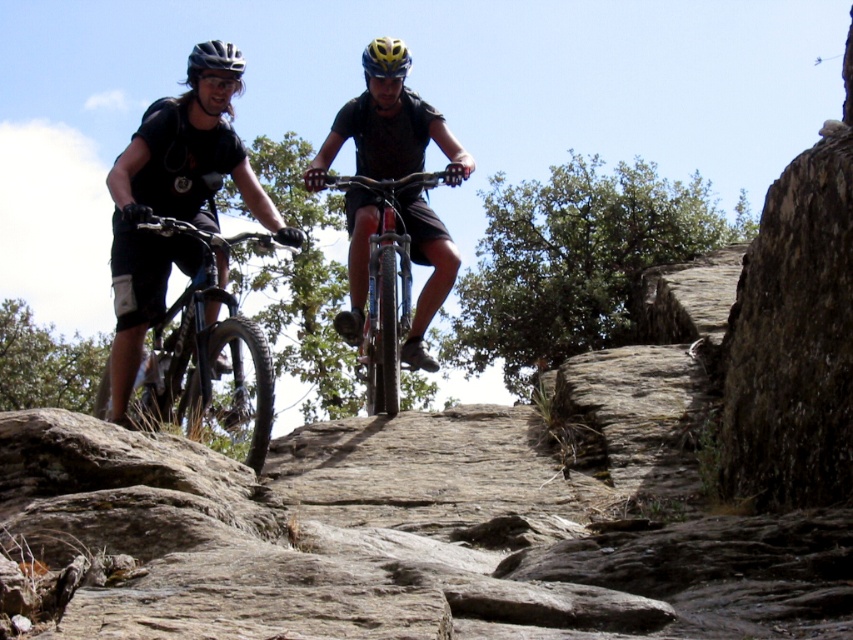
You are a photographer standing at the origin point of the coordinate system. You want to capture a photo of the shiny black bike at left. Given that the coordinate system has its origin at the bottom left corner of the image, with the x and y axes increasing to the right and up respectively, can you determine if the point at coordinates point (207,356) is closer to the shiny black bike at left than the other bike?

The point at coordinates point (207,356) corresponds to the shiny black bike at left, so yes, it is closer to the shiny black bike at left than the other bike.

You are a photographer positioned at the bottom of the trail. You want to capture a photo that includes both the shiny black bike at left and the matte black helmet at upper left. Which object should you focus on first to ensure both are in frame?

The shiny black bike at left is below the matte black helmet at upper left, so you should focus on the matte black helmet at upper left first to ensure both are in frame.